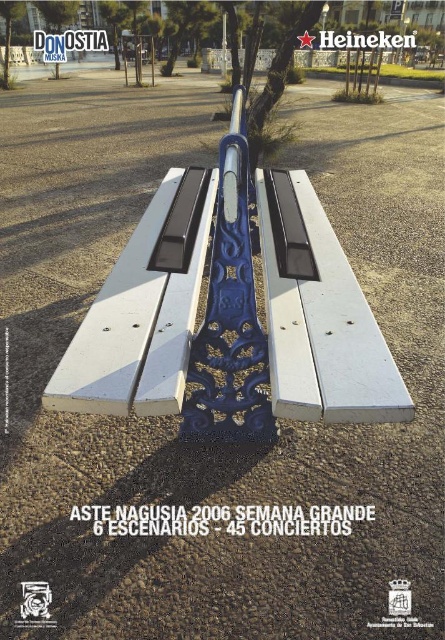
You are planning to place a decorative planter between the white painted wood bench at center and the blue metallic pole at center. Since the bench is wider, where should you position the planter to ensure it is closer to the narrower object?

The white painted wood bench at center is wider than the blue metallic pole at center. To place the planter closer to the narrower object, position it near the blue metallic pole at center.

You are a city planner assessing the placement of the white painted wood bench at center and the blue metallic pole at center. Based on their positions, which object is closer to the ground?

The white painted wood bench at center is located below the blue metallic pole at center, so the bench is closer to the ground than the pole.

You are standing in a park and see the white painted wood bench at center and the blue metallic pole at center. Which object is located to the right of the other?

The white painted wood bench at center is positioned on the right side of blue metallic pole at center, so the white painted wood bench at center is to the right of the blue metallic pole at center.